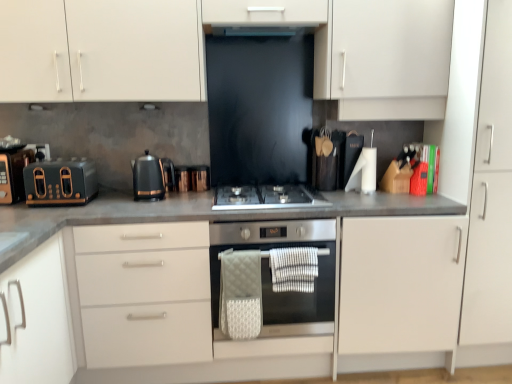
Question: Is matte black toaster at left, the first kitchen appliance from the left, turned away from white matte cabinet at right?

Choices:
 (A) no
 (B) yes

Answer: (A)

Question: Considering the relative sizes of matte black toaster at left, which ranks as the 2th kitchen appliance in right-to-left order, and white matte cabinet at right in the image provided, is matte black toaster at left, which ranks as the 2th kitchen appliance in right-to-left order, shorter than white matte cabinet at right?

Choices:
 (A) no
 (B) yes

Answer: (B)

Question: From a real-world perspective, is matte black toaster at left, the first kitchen appliance from the left, on white matte cabinet at right?

Choices:
 (A) yes
 (B) no

Answer: (A)

Question: Is matte black toaster at left, which ranks as the 2th kitchen appliance in right-to-left order, positioned beyond the bounds of white matte cabinet at right?

Choices:
 (A) yes
 (B) no

Answer: (A)

Question: Can you confirm if matte black toaster at left, the first kitchen appliance from the left, is smaller than white matte cabinet at right?

Choices:
 (A) yes
 (B) no

Answer: (A)

Question: In terms of width, does white textured hand towel at center, placed as the first hand towel when sorted from right to left, look wider or thinner when compared to stainless steel oven at center?

Choices:
 (A) thin
 (B) wide

Answer: (A)

Question: Is white textured hand towel at center, which appears as the second hand towel when viewed from the left, situated inside stainless steel oven at center or outside?

Choices:
 (A) outside
 (B) inside

Answer: (B)

Question: From a real-world perspective, is white textured hand towel at center, which appears as the second hand towel when viewed from the left, positioned above or below stainless steel oven at center?

Choices:
 (A) above
 (B) below

Answer: (A)

Question: Is white textured hand towel at center, placed as the first hand towel when sorted from right to left, taller or shorter than stainless steel oven at center?

Choices:
 (A) tall
 (B) short

Answer: (B)

Question: From a real-world perspective, is black glass exhaust hood at upper center physically located above or below white matte cabinet at right?

Choices:
 (A) below
 (B) above

Answer: (B)

Question: In terms of size, does black glass exhaust hood at upper center appear bigger or smaller than white matte cabinet at right?

Choices:
 (A) small
 (B) big

Answer: (A)

Question: In terms of width, does black glass exhaust hood at upper center look wider or thinner when compared to white matte cabinet at right?

Choices:
 (A) thin
 (B) wide

Answer: (A)

Question: Is black glass exhaust hood at upper center taller or shorter than white matte cabinet at right?

Choices:
 (A) tall
 (B) short

Answer: (B)

Question: In the image, is satin silver gas stove at center positioned in front of or behind matte black toaster at left, the 3th appliance positioned from the right?

Choices:
 (A) front
 (B) behind

Answer: (A)

Question: From the image's perspective, is satin silver gas stove at center located above or below matte black toaster at left, the 3th appliance positioned from the right?

Choices:
 (A) above
 (B) below

Answer: (B)